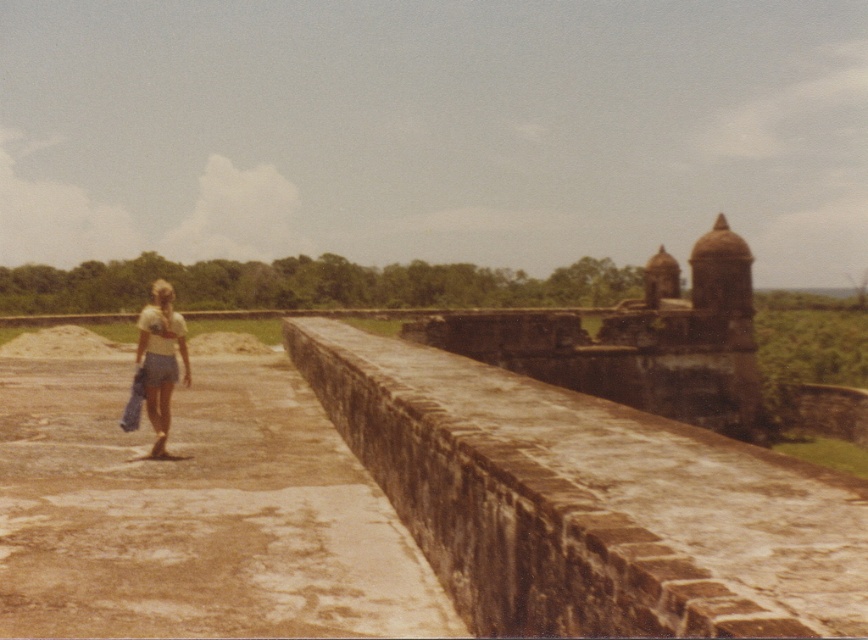
Question: Does brown stone moat at center have a lesser width compared to brown stone fort at center?

Choices:
 (A) no
 (B) yes

Answer: (B)

Question: Which is farther from the brown stone moat at center?

Choices:
 (A) white cotton shirt at center
 (B) brown stone fort at center

Answer: (B)

Question: Which point is farther to the camera?

Choices:
 (A) brown stone moat at center
 (B) white cotton shirt at center

Answer: (B)

Question: Is brown stone fort at center to the left of white cotton shirt at center from the viewer's perspective?

Choices:
 (A) yes
 (B) no

Answer: (B)

Question: Is the position of brown stone moat at center less distant than that of white cotton shirt at center?

Choices:
 (A) no
 (B) yes

Answer: (B)

Question: Which object appears closest to the camera in this image?

Choices:
 (A) brown stone fort at center
 (B) white cotton shirt at center

Answer: (B)